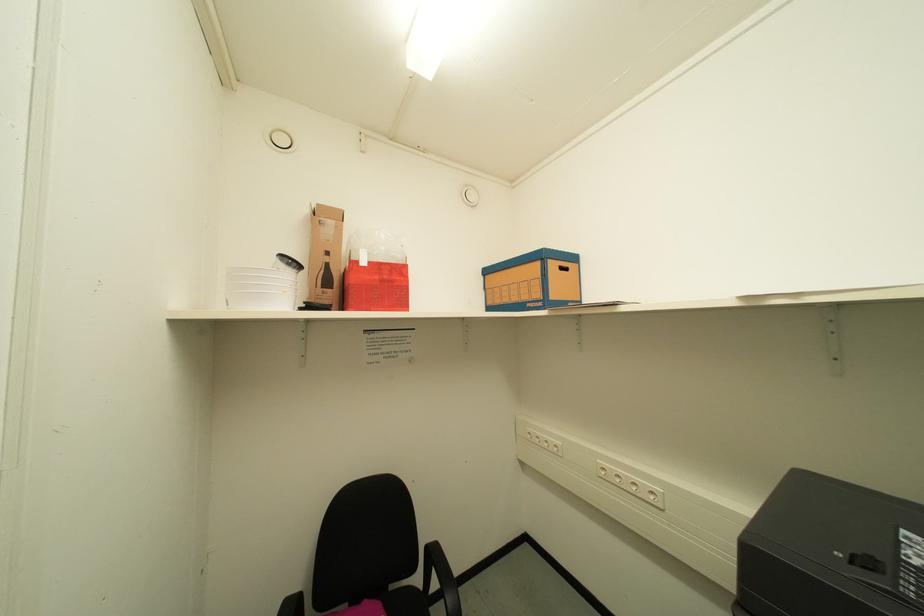
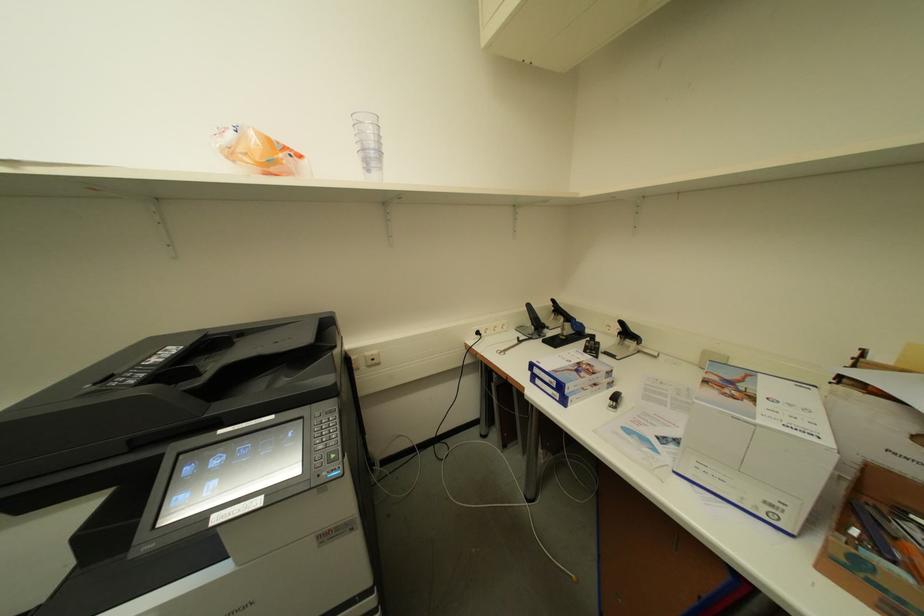
The images are taken continuously from a first-person perspective. In which direction is your viewpoint rotating?

The rotation direction of the camera is right-down.